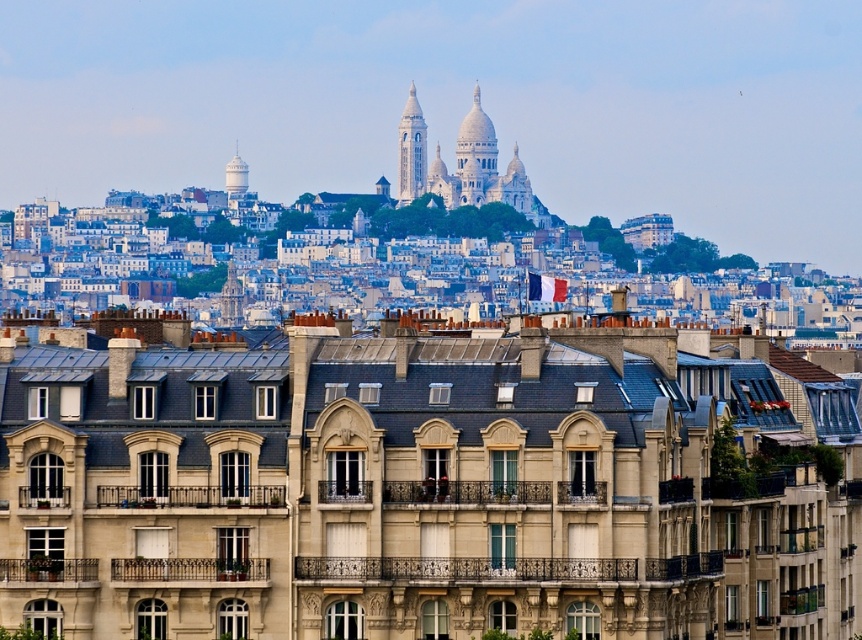
Question: Based on their relative distances, which object is farther from the white glossy water tower at upper center?

Choices:
 (A) white stone tower at center
 (B) white stone dome at center
 (C) white stone tower at upper center

Answer: (A)

Question: Which point is farther from the camera taking this photo?

Choices:
 (A) (413, 163)
 (B) (513, 195)
 (C) (242, 180)
 (D) (485, 170)

Answer: (C)

Question: Does white stone dome at center come in front of white glossy water tower at upper center?

Choices:
 (A) yes
 (B) no

Answer: (A)

Question: Which point is farther to the camera?

Choices:
 (A) (242, 193)
 (B) (481, 182)

Answer: (A)

Question: Does white stone tower at upper center appear on the right side of white stone tower at center?

Choices:
 (A) yes
 (B) no

Answer: (B)

Question: Can you confirm if white stone tower at upper center is positioned above white glossy water tower at upper center?

Choices:
 (A) yes
 (B) no

Answer: (A)